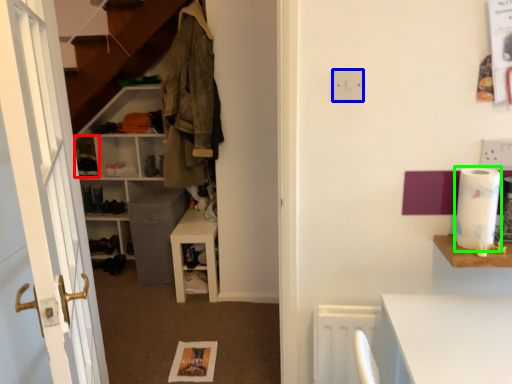
Question: Which object is the farthest from cabinet (highlighted by a red box)? Choose among these: electric outlet (highlighted by a blue box) or toilet paper (highlighted by a green box).

Choices:
 (A) electric outlet
 (B) toilet paper

Answer: (B)